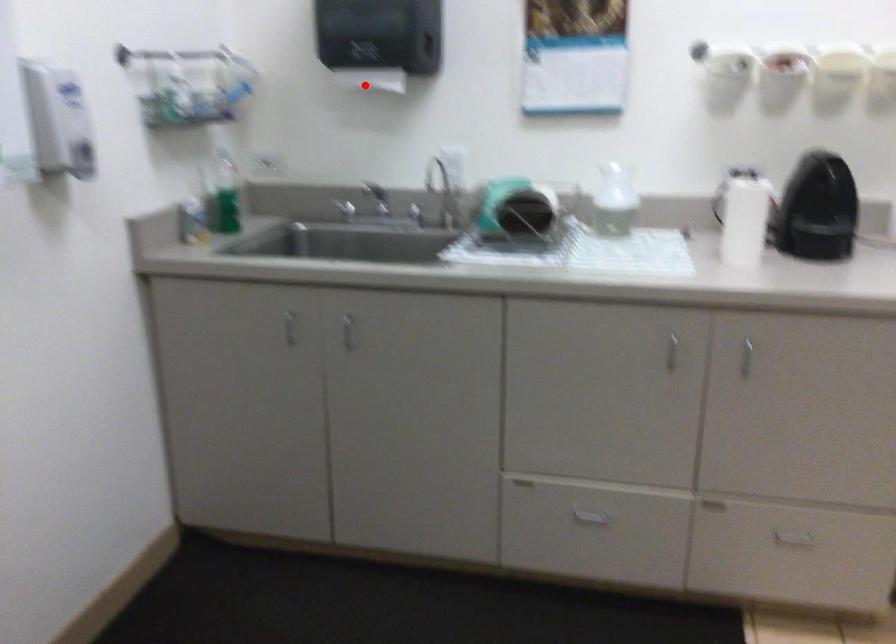
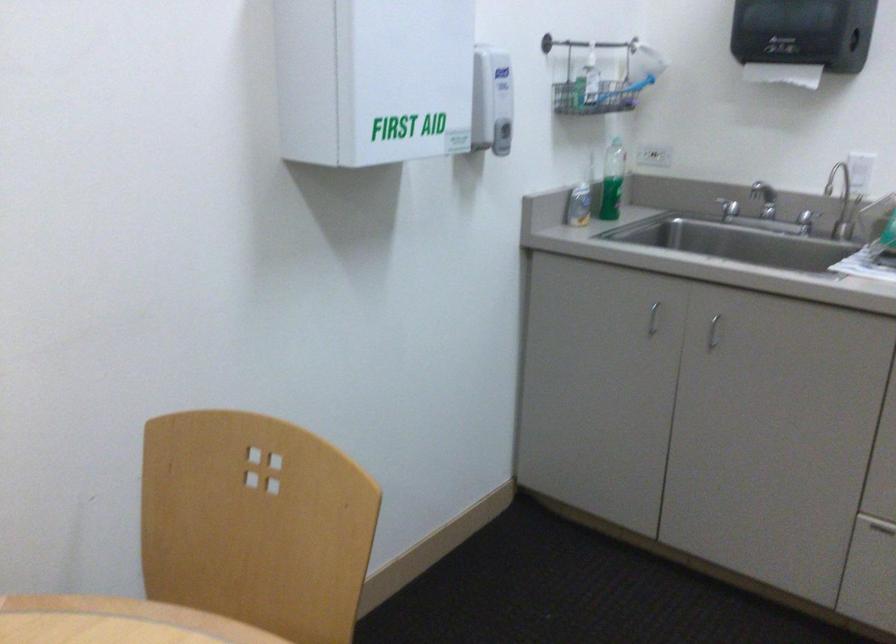
Question: I am providing you with two images of the same scene from different viewpoints. In image1, a red point is highlighted. Considering the same 3D point in image2, which of the following is correct?

Choices:
 (A) It is closer
 (B) It is farther

Answer: (A)